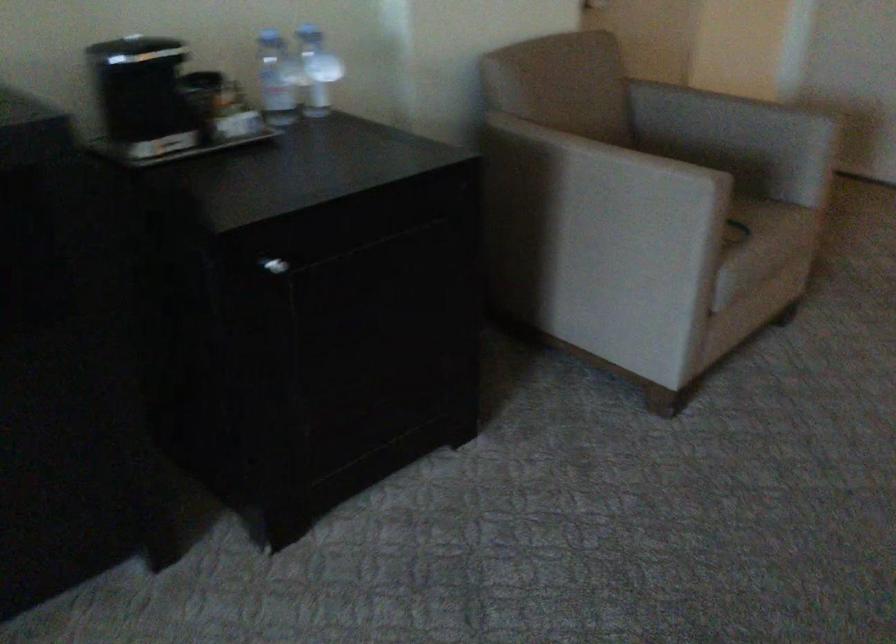
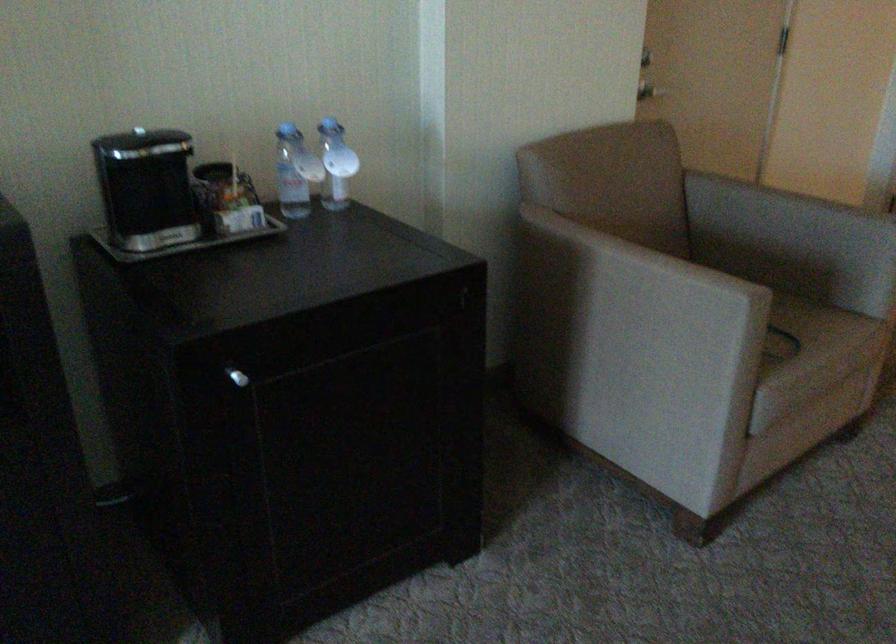
In the second image, find the point that corresponds to [323,73] in the first image.

(336, 164)